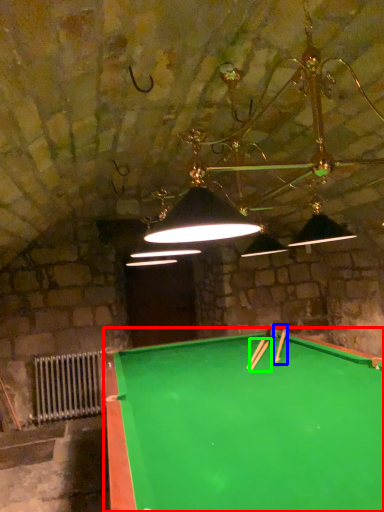
Question: Considering the real-world distances, which object is farthest from billiard table (highlighted by a red box)? cue (highlighted by a blue box) or cue (highlighted by a green box)?

Choices:
 (A) cue
 (B) cue

Answer: (A)